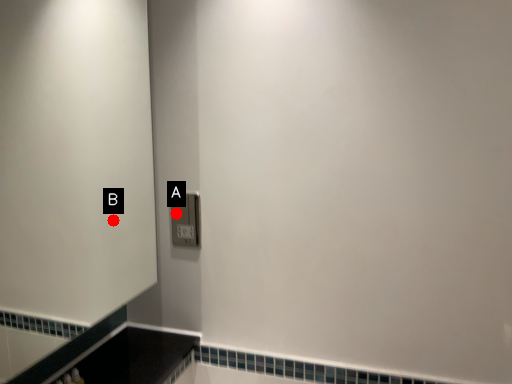
Question: Two points are circled on the image, labeled by A and B beside each circle. Which point is farther to the camera?

Choices:
 (A) A is further
 (B) B is further

Answer: (B)